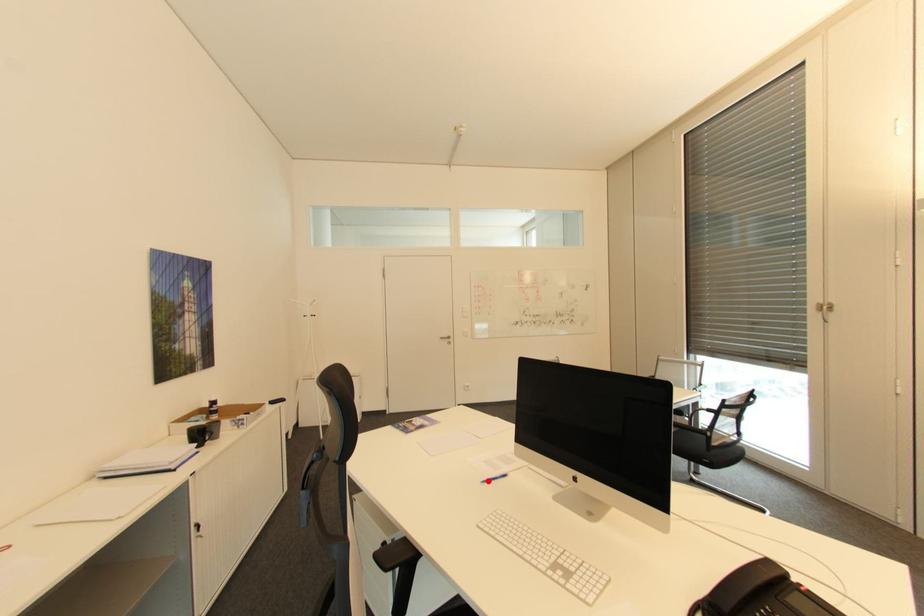
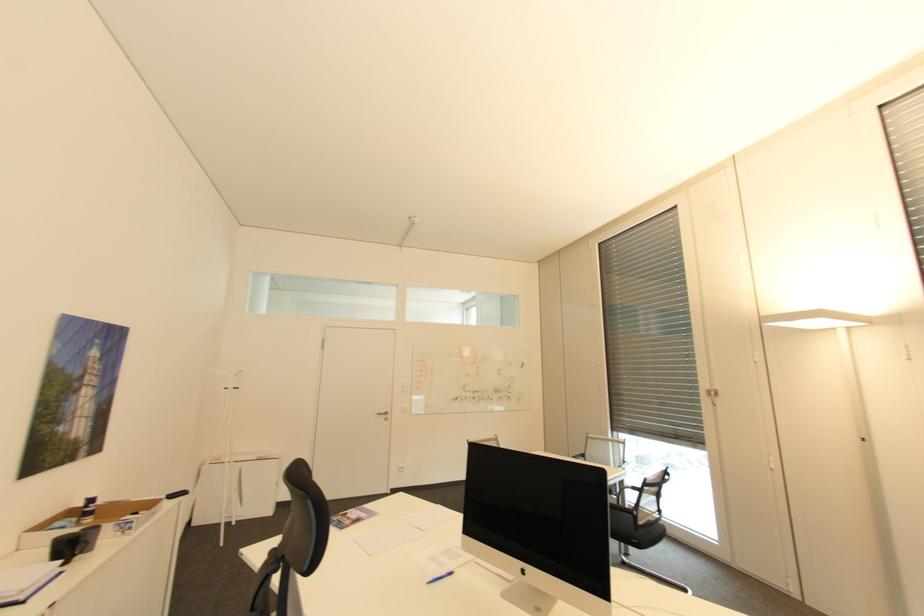
Where in the second image is the point corresponding to the highlighted location from the first image?

(434, 582)